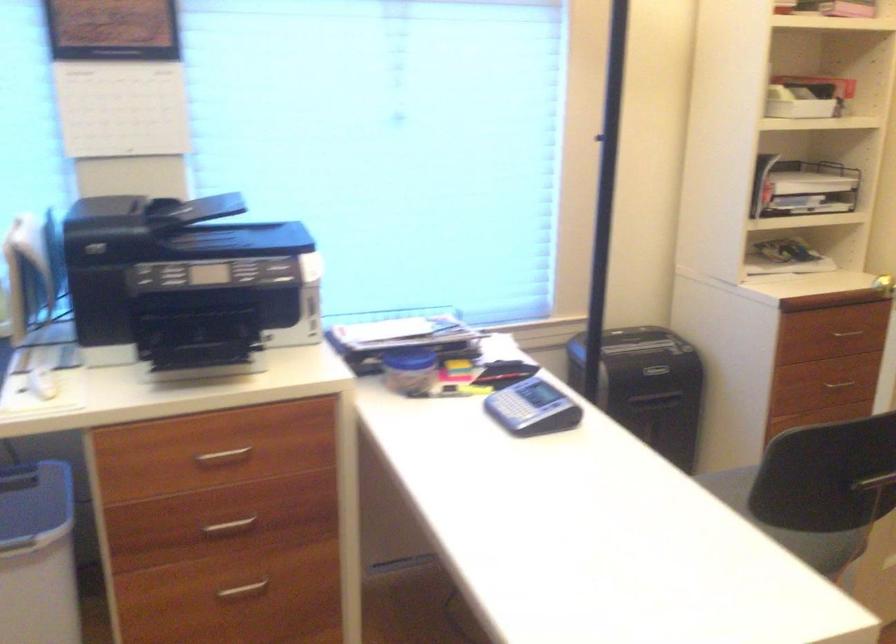
Where would you sit the chair sitting surface? Please return your answer as a coordinate pair (x, y).

(788, 525)